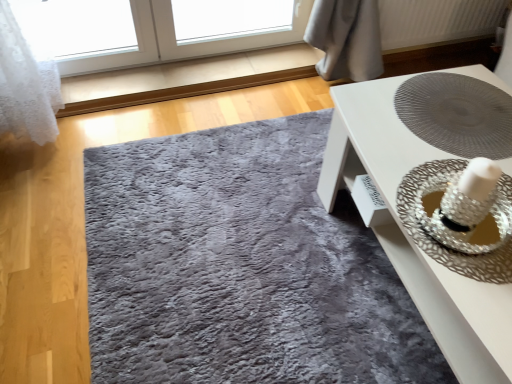
Question: Is white glossy table at center wider or thinner than white textured radiator at upper right?

Choices:
 (A) wide
 (B) thin

Answer: (A)

Question: In the image, is white glossy table at center on the left side or the right side of white textured radiator at upper right?

Choices:
 (A) right
 (B) left

Answer: (B)

Question: Which is nearer to the silver metallic straw hat at right?

Choices:
 (A) shaggy gray rug at center
 (B) white glossy table at center
 (C) white textured radiator at upper right

Answer: (B)

Question: Which is farther from the silver metallic straw hat at right?

Choices:
 (A) shaggy gray rug at center
 (B) white glossy table at center
 (C) white textured radiator at upper right

Answer: (C)